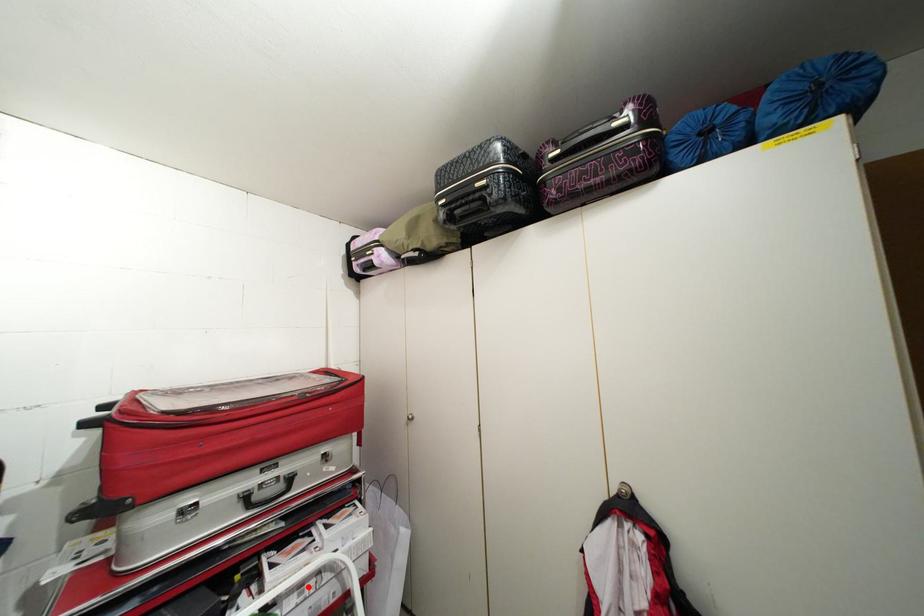
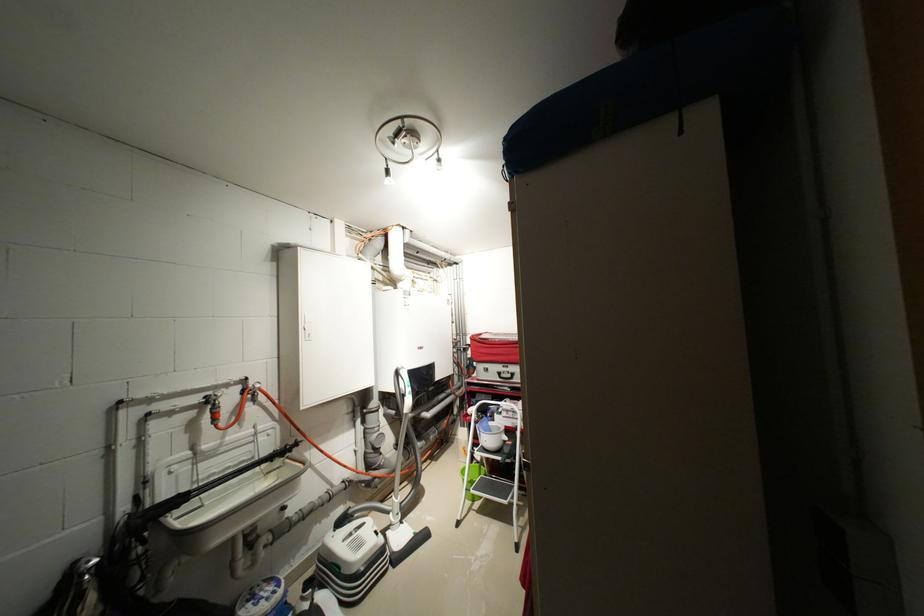
Question: I am providing you with two images of the same scene from different viewpoints. Given a red point in image1, look at the same physical point in image2. Is it:

Choices:
 (A) Closer to the viewpoint
 (B) Farther from the viewpoint

Answer: (B)